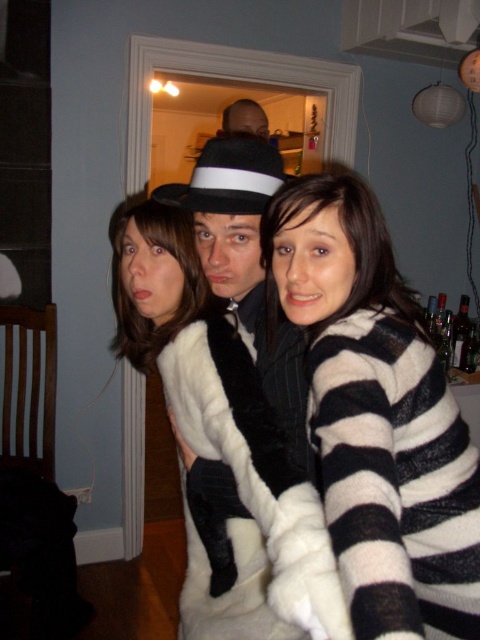
Can you confirm if black and white striped sweater at center is thinner than white fur coat at center?

No.

Can you confirm if black and white striped sweater at center is wider than white fur coat at center?

Correct, the width of black and white striped sweater at center exceeds that of white fur coat at center.

Describe the element at coordinates (377, 417) in the screenshot. I see `black and white striped sweater at center` at that location.

The image size is (480, 640). I want to click on black and white striped sweater at center, so click(377, 417).